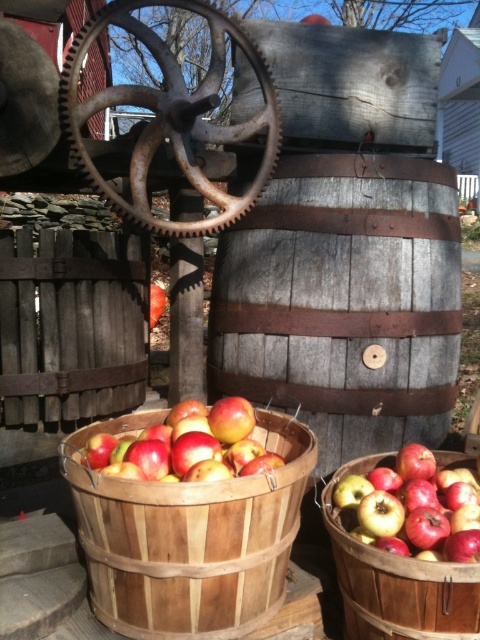
You are an apple picker who needs to collect apples from the scene. You see the shiny red apples at center and the gray wooden barrel at center. Which object is closer to you?

The gray wooden barrel at center is closer to you because the shiny red apples at center are behind it.

You need to place a rectangular box that is 1 meter wide between the gray wooden barrel at center and the rusty metal gear at center. Based on their widths, will the box fit between them?

The gray wooden barrel at center is wider than the rusty metal gear at center. Since the box is 1 meter wide, it depends on the actual width difference between the two objects. However, without specific measurements, we cannot confirm if the space between them is sufficient for the box.